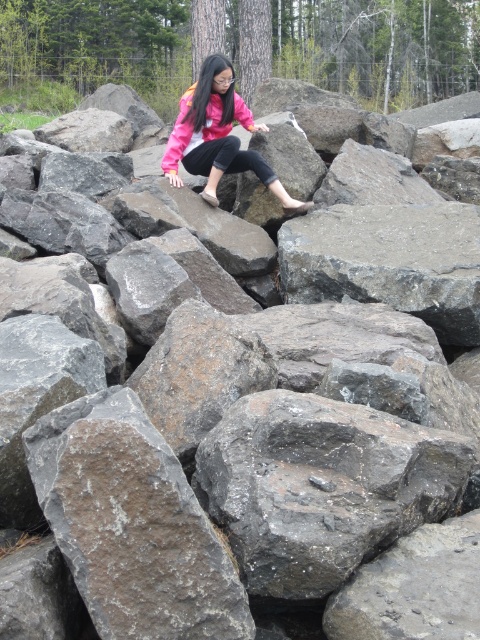
Question: Which object is farther from the camera taking this photo?

Choices:
 (A) pink fleece jacket at center
 (B) pink matte jacket at center

Answer: (B)

Question: Which of the following is the farthest from the observer?

Choices:
 (A) (199, 134)
 (B) (250, 161)

Answer: (A)

Question: Can you confirm if pink fleece jacket at center is thinner than pink matte jacket at center?

Choices:
 (A) yes
 (B) no

Answer: (B)

Question: Is pink fleece jacket at center bigger than pink matte jacket at center?

Choices:
 (A) no
 (B) yes

Answer: (B)

Question: Is the position of pink fleece jacket at center more distant than that of pink matte jacket at center?

Choices:
 (A) no
 (B) yes

Answer: (A)